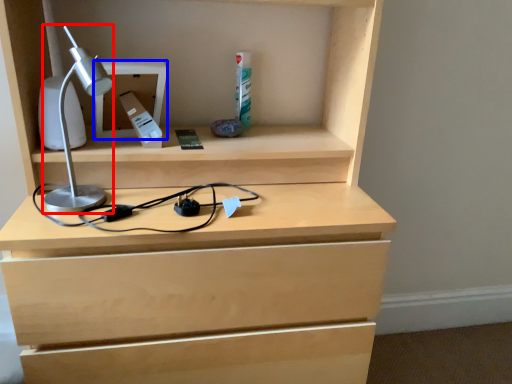
Question: Which object is closer to the camera taking this photo, lamp (highlighted by a red box) or cabinet (highlighted by a blue box)?

Choices:
 (A) lamp
 (B) cabinet

Answer: (A)